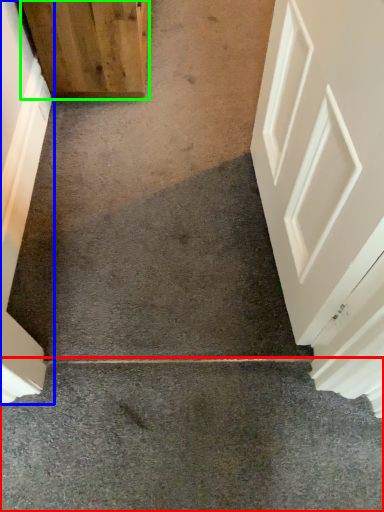
Question: Based on their relative distances, which object is nearer to concrete (highlighted by a red box)? Choose from door (highlighted by a blue box) and door (highlighted by a green box).

Choices:
 (A) door
 (B) door

Answer: (A)